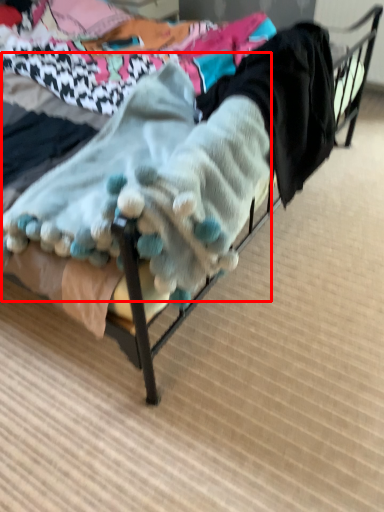
Question: From the image, what is the correct spatial relationship of baby clothe (annotated by the red box) in relation to clothing?

Choices:
 (A) left
 (B) right

Answer: (A)